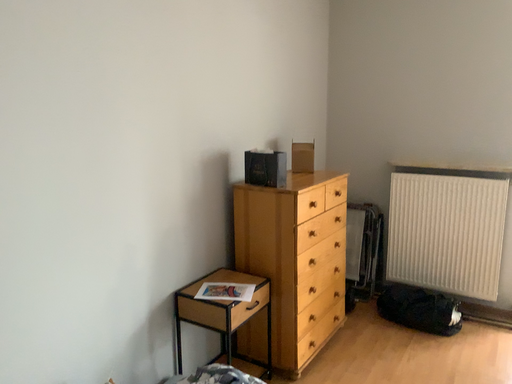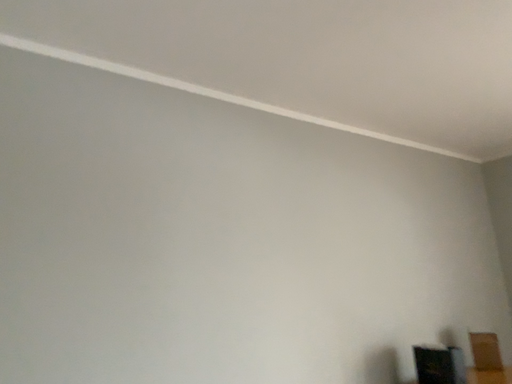
Question: Which way did the camera rotate in the video?

Choices:
 (A) rotated upward
 (B) rotated downward

Answer: (A)